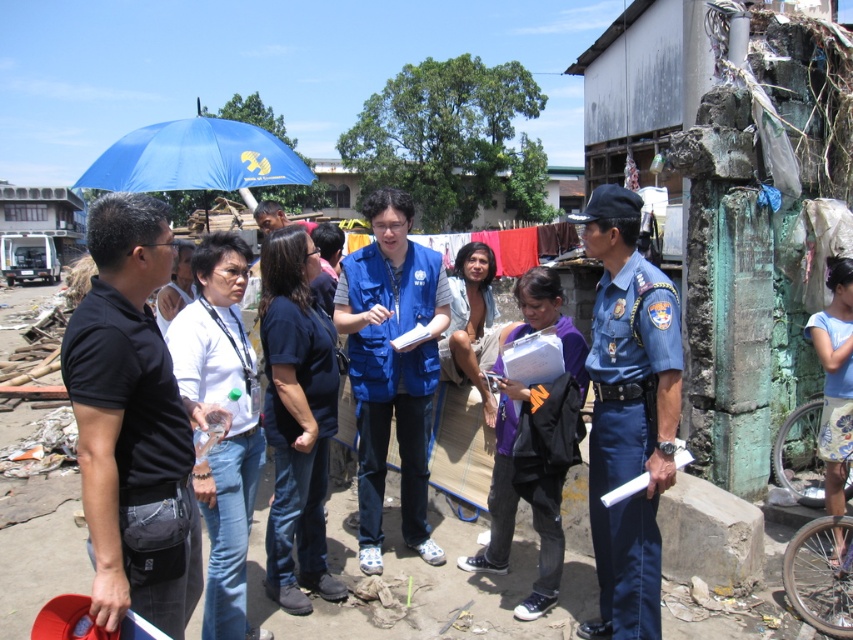
You are a drone operator trying to capture aerial footage of the scene. You need to ensure that both the point at (631, 632) and the point at (161, 150) are visible in your shot. Given their positions, which point should you prioritize focusing on to ensure both are in frame?

Since point (631, 632) is closer to the viewer than point (161, 150), you should prioritize focusing on point (631, 632) to ensure both points are in frame.

You are standing at the viewer position in the scene. There is a point at coordinate (x=131, y=342). Can you reach that point without moving your feet?

The distance between the point at coordinate (x=131, y=342) and the viewer is 2.46 meters. Since you are not moving your feet, you cannot reach that point which is 2.46 meters away.